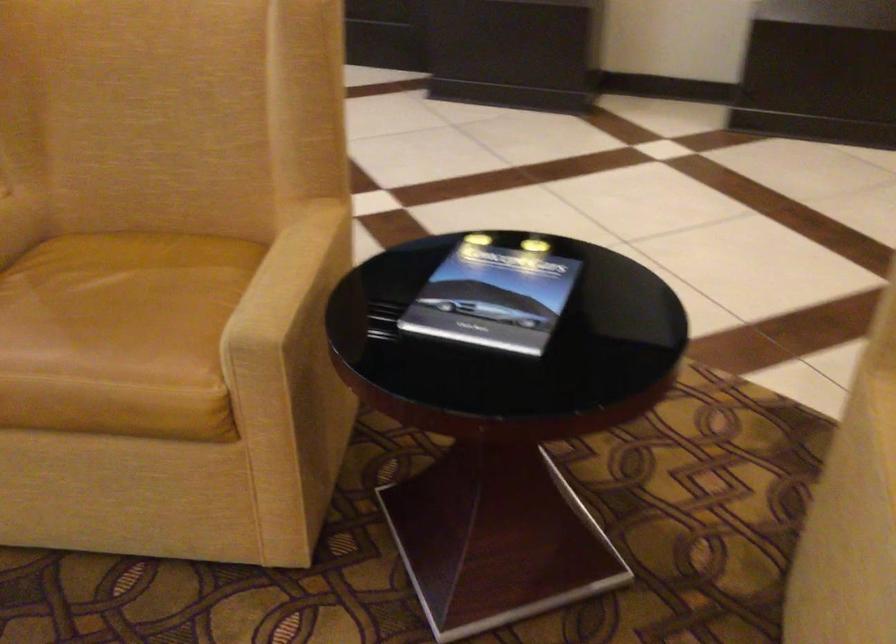
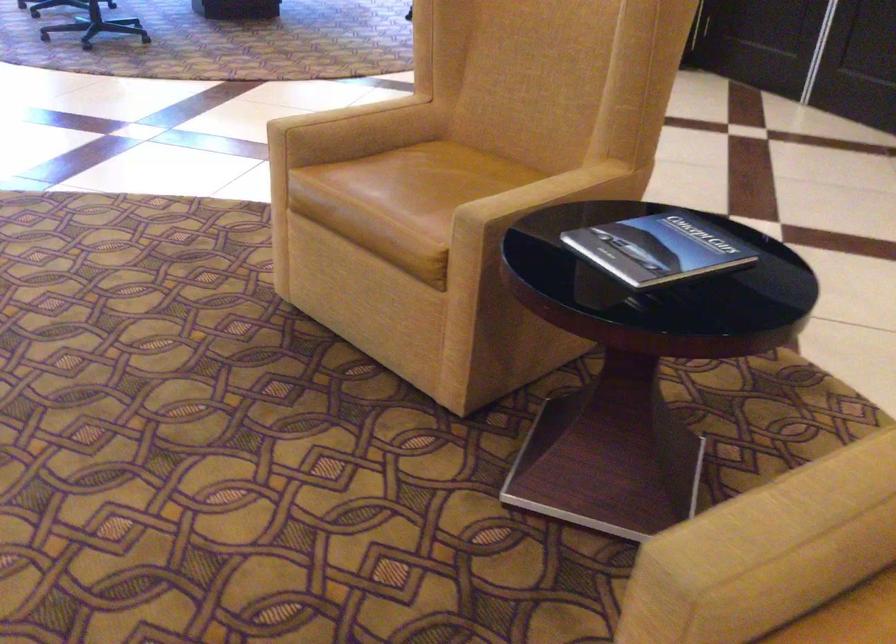
Question: The camera is either moving clockwise (left) or counter-clockwise (right) around the object. The first image is from the beginning of the video and the second image is from the end. Is the camera moving left or right when shooting the video?

Choices:
 (A) Left
 (B) Right

Answer: (B)